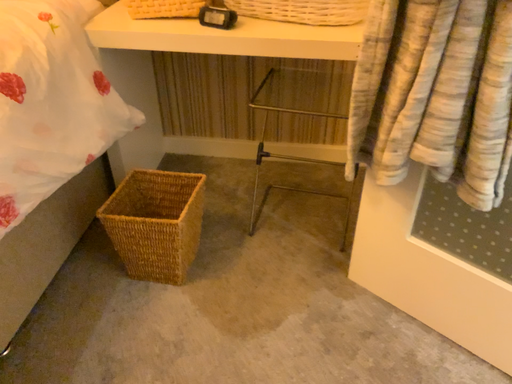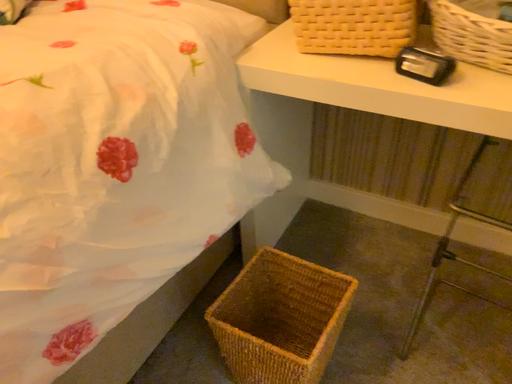
Question: Which way did the camera rotate in the video?

Choices:
 (A) rotated left
 (B) rotated right

Answer: (A)